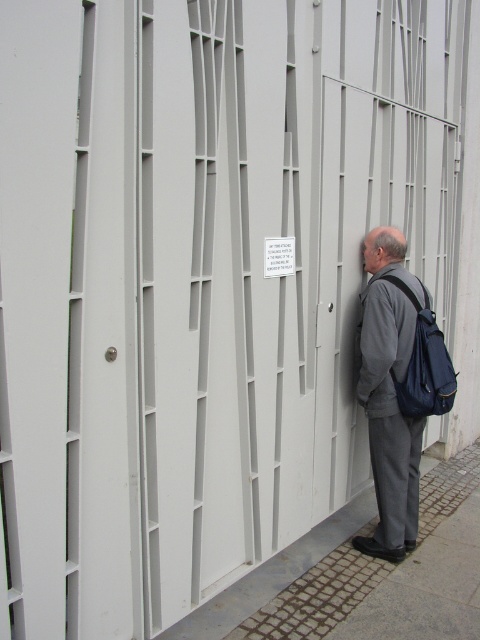
Describe the element at coordinates (363, 573) in the screenshot. Image resolution: width=480 pixels, height=640 pixels. I see `gray cobblestone pavement at lower right` at that location.

Between gray cobblestone pavement at lower right and gray fabric backpack at right, which one appears on the left side from the viewer's perspective?

From the viewer's perspective, gray fabric backpack at right appears more on the left side.

Does point (459, 611) come behind point (408, 518)?

No, (459, 611) is closer to viewer.

Identify the location of gray cobblestone pavement at lower right. (363, 573).